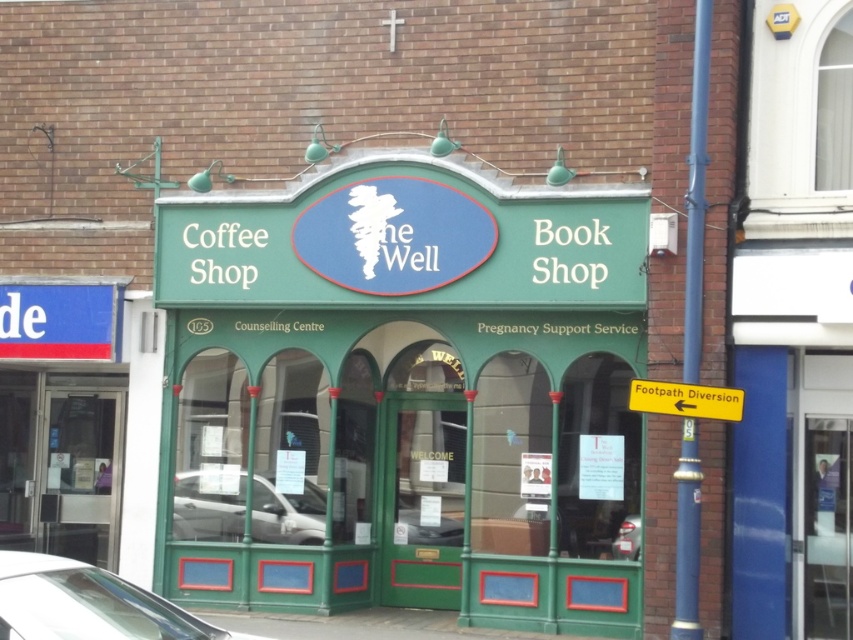
You are standing in front of the building and want to touch both the green painted wood at center and the yellow plastic sign at right. Which object should you reach for first to touch the closer one?

The green painted wood at center is closer to you than the yellow plastic sign at right, so you should reach for the green painted wood at center first.

You are a customer arriving at the storefront and see the green painted wood at center and the white glossy car at lower left. Which object is closer to the entrance of the building?

The white glossy car at lower left is closer to the entrance of the building because the green painted wood at center is to the right of it, meaning the car is positioned to the left side and closer to the entrance.

You are a pedestrian standing in front of the storefront. You see a silver metallic car at center and a yellow plastic sign at right. Which object is bigger in size?

The silver metallic car at center is larger in size compared to the yellow plastic sign at right.